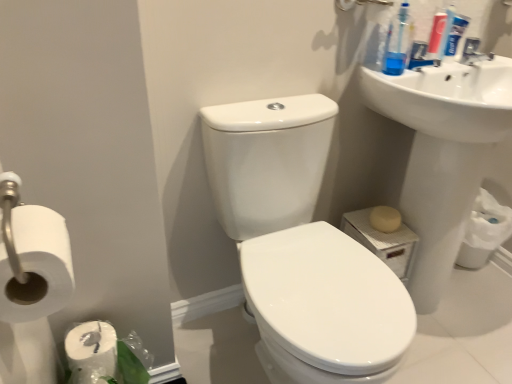
You are a GUI agent. You are given a task and a screenshot of the screen. Output one action in this format:
    pyautogui.click(x=<x>, y=<y>)
    Task: Click on the free space between white glossy sink at upper right, placed as the second sink when sorted from left to right, and white matte toilet paper at lower right, the 1th toilet paper viewed from the back
    Image resolution: width=512 pixels, height=384 pixels.
    Given the screenshot: What is the action you would take?
    pyautogui.click(x=496, y=287)